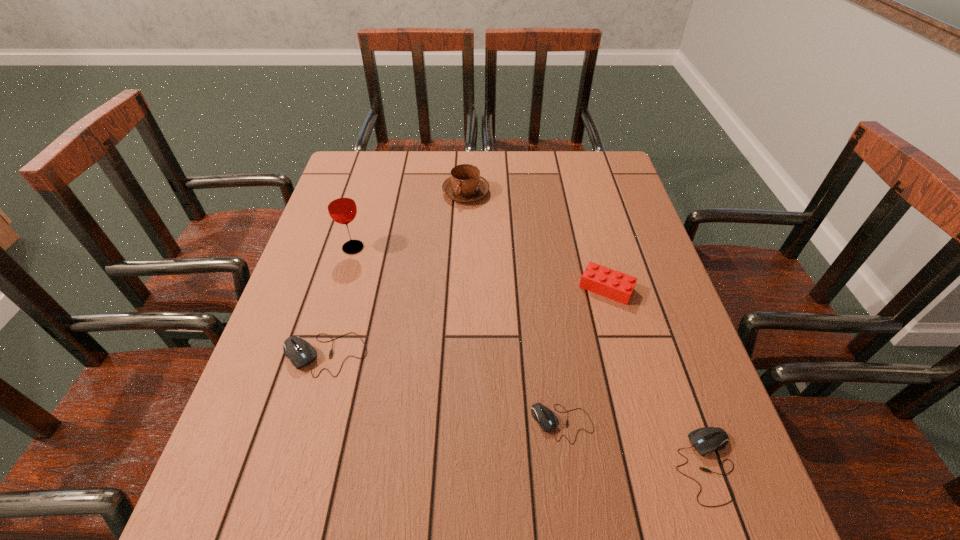
Image resolution: width=960 pixels, height=540 pixels. Find the location of `glass present at the left edge`. glass present at the left edge is located at coordinates (341, 205).

You are a GUI agent. You are given a task and a screenshot of the screen. Output one action in this format:
    pyautogui.click(x=<x>, y=<y>)
    Task: Click on the computer mouse that is at the right edge
    
    Given the screenshot: What is the action you would take?
    pyautogui.click(x=707, y=439)

Where is `Lego that is at the right edge`? The image size is (960, 540). Lego that is at the right edge is located at coordinates click(596, 278).

You are a GUI agent. You are given a task and a screenshot of the screen. Output one action in this format:
    pyautogui.click(x=<x>, y=<y>)
    Task: Click on the object situated at the near right corner
    
    Given the screenshot: What is the action you would take?
    pyautogui.click(x=707, y=439)

Locate an element on the screen. Image resolution: width=960 pixels, height=540 pixels. vacant space at the far edge is located at coordinates (402, 158).

The height and width of the screenshot is (540, 960). Find the location of `vacant region at the left edge`. vacant region at the left edge is located at coordinates (282, 361).

The image size is (960, 540). In the image, there is a desktop. What are the coordinates of `vacant space at the right edge` in the screenshot? It's located at (633, 320).

In order to click on vacant region at the far left corner of the desktop in this screenshot , I will do `click(375, 183)`.

In the image, there is a desktop. Find the location of `vacant space at the far right corner`. vacant space at the far right corner is located at coordinates (585, 181).

I want to click on vacant area between the third tallest object and the cappuccino, so click(536, 240).